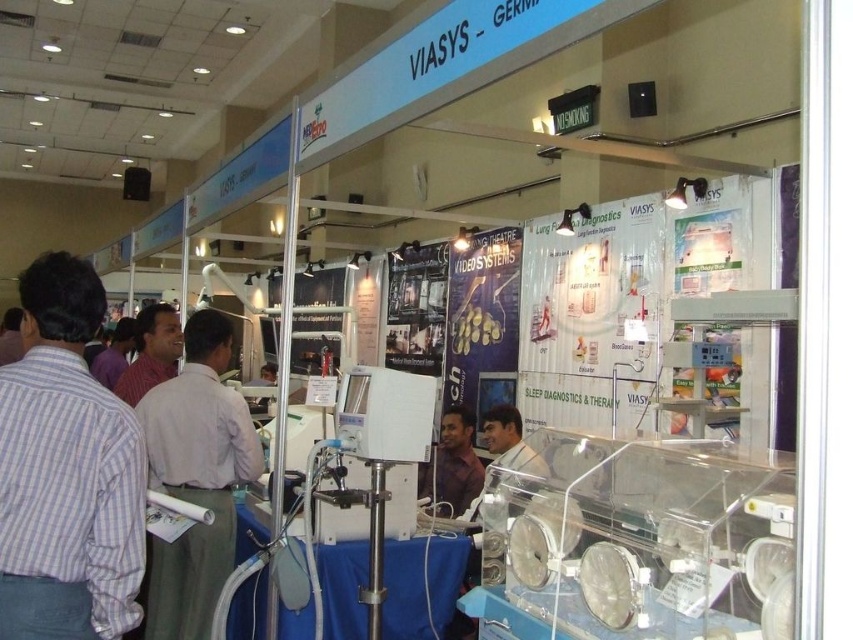
You are a customer at the Viasys booth and want to examine both the matte brown shirt at center and the matte pink shirt at left. Which shirt should you approach first to get a closer look without obstructing the view of the other?

You should approach the matte brown shirt at center first since it is in front of the matte pink shirt at left. By examining it first, you can then move around it to view the matte pink shirt at left without blocking either one.

You are standing in the Viasys booth at the exhibition. There are two points marked in the booth. The first point is at coordinate (102, 502) and the second is at (175, 356). If you are facing the booth entrance, which point is closer to you?

Point (102, 502) is in front of point (175, 356), so if you are facing the booth entrance, the point closer to you is point (102, 502).